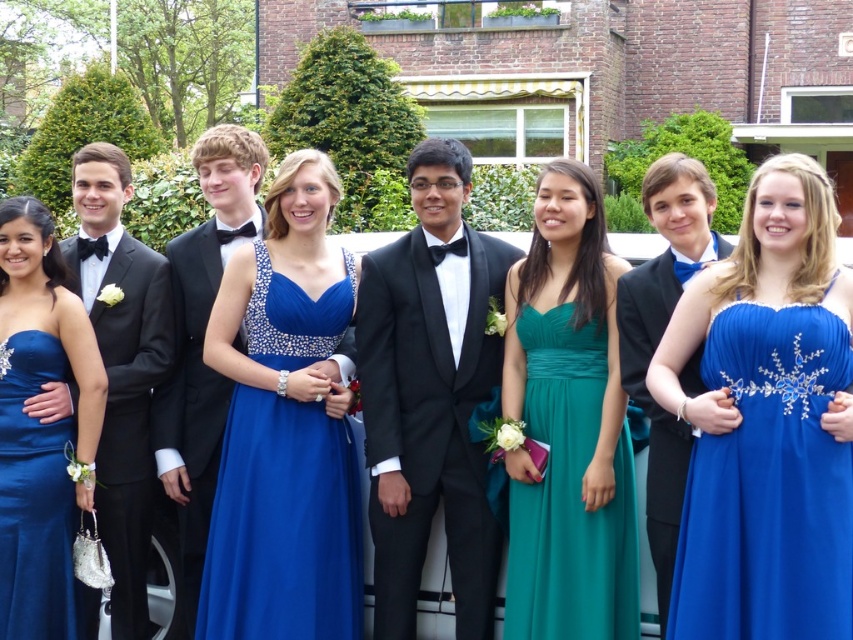
Question: Is teal satin dress at center positioned before black satin tuxedo at left?

Choices:
 (A) no
 (B) yes

Answer: (B)

Question: Is black satin tuxedo at center bigger than teal satin dress at center?

Choices:
 (A) no
 (B) yes

Answer: (A)

Question: Which of the following is the closest to the observer?

Choices:
 (A) (677, 420)
 (B) (91, 604)

Answer: (A)

Question: Estimate the real-world distances between objects in this image. Which object is farther from the matte black suit at center?

Choices:
 (A) black satin tuxedo at center
 (B) royal blue satin dress at center
 (C) teal satin dress at center

Answer: (A)

Question: Can you confirm if shiny blue dress at center is positioned above matte blue dress at left?

Choices:
 (A) yes
 (B) no

Answer: (B)

Question: Which point is closer to the camera?

Choices:
 (A) matte black suit at center
 (B) matte blue dress at left
 (C) teal satin dress at center
 (D) royal blue satin dress at center

Answer: (D)